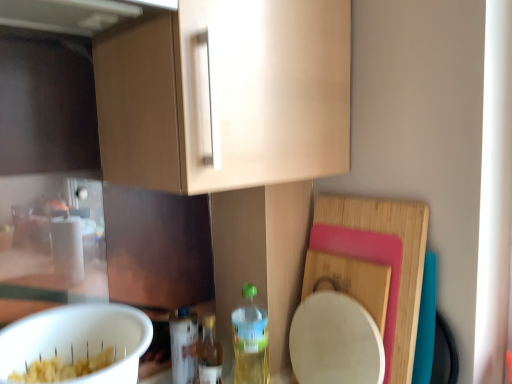
This screenshot has width=512, height=384. What do you see at coordinates (184, 345) in the screenshot? I see `translucent plastic bottle at lower center, arranged as the 1th bottle when viewed from the left` at bounding box center [184, 345].

What do you see at coordinates (250, 338) in the screenshot?
I see `translucent plastic bottle at lower center, the third bottle when ordered from left to right` at bounding box center [250, 338].

The image size is (512, 384). Describe the element at coordinates (79, 340) in the screenshot. I see `white matte mixing bowl at lower left` at that location.

Identify the location of translucent plastic bottle at lower center, arranged as the 1th bottle when viewed from the left. This screenshot has height=384, width=512. (184, 345).

Does white matte mixing bowl at lower left have a lesser height compared to translucent plastic bottle at lower center, which is the 1th bottle from right to left?

Correct, white matte mixing bowl at lower left is not as tall as translucent plastic bottle at lower center, which is the 1th bottle from right to left.

Considering the relative sizes of white matte mixing bowl at lower left and translucent plastic bottle at lower center, the third bottle when ordered from left to right, in the image provided, is white matte mixing bowl at lower left bigger than translucent plastic bottle at lower center, the third bottle when ordered from left to right,?

Yes.

Can we say white matte mixing bowl at lower left lies outside translucent plastic bottle at lower center, the third bottle when ordered from left to right?

Yes, white matte mixing bowl at lower left is not within translucent plastic bottle at lower center, the third bottle when ordered from left to right.

Which is more distant, (263, 335) or (214, 372)?

The point (214, 372) is farther from the camera.

From a real-world perspective, does translucent plastic bottle at lower center, which is the 1th bottle from right to left, stand above translucent plastic bottle at lower center, marked as the second bottle in a left-to-right arrangement?

Yes, from a real-world perspective, translucent plastic bottle at lower center, which is the 1th bottle from right to left, is over translucent plastic bottle at lower center, marked as the second bottle in a left-to-right arrangement

From the image's perspective, which one is positioned lower, translucent plastic bottle at lower center, which is the 1th bottle from right to left, or translucent plastic bottle at lower center, marked as the second bottle in a left-to-right arrangement?

translucent plastic bottle at lower center, marked as the second bottle in a left-to-right arrangement, from the image's perspective.

Considering the relative positions of translucent plastic bottle at lower center, which is the 1th bottle from right to left, and translucent plastic bottle at lower center, marked as the second bottle in a left-to-right arrangement, in the image provided, is translucent plastic bottle at lower center, which is the 1th bottle from right to left, to the right of translucent plastic bottle at lower center, marked as the second bottle in a left-to-right arrangement, from the viewer's perspective?

Yes.

Can you confirm if translucent plastic bottle at lower center, the third bottle when ordered from left to right, is positioned to the right of translucent plastic bottle at lower center, arranged as the 1th bottle when viewed from the left?

Yes, translucent plastic bottle at lower center, the third bottle when ordered from left to right, is to the right of translucent plastic bottle at lower center, arranged as the 1th bottle when viewed from the left.

Is translucent plastic bottle at lower center, the third bottle when ordered from left to right, looking in the opposite direction of translucent plastic bottle at lower center, the third bottle in the right-to-left sequence?

No, translucent plastic bottle at lower center, the third bottle when ordered from left to right, is not facing the opposite direction of translucent plastic bottle at lower center, the third bottle in the right-to-left sequence.

Based on the photo, does translucent plastic bottle at lower center, the third bottle when ordered from left to right, have a lesser height compared to translucent plastic bottle at lower center, arranged as the 1th bottle when viewed from the left?

Incorrect, the height of translucent plastic bottle at lower center, the third bottle when ordered from left to right, does not fall short of that of translucent plastic bottle at lower center, arranged as the 1th bottle when viewed from the left.

Is translucent plastic bottle at lower center, the 2th bottle viewed from the right, to the left or to the right of translucent plastic bottle at lower center, the third bottle in the right-to-left sequence, in the image?

In the image, translucent plastic bottle at lower center, the 2th bottle viewed from the right, appears on the right side of translucent plastic bottle at lower center, the third bottle in the right-to-left sequence.

Is translucent plastic bottle at lower center, marked as the second bottle in a left-to-right arrangement, facing away from translucent plastic bottle at lower center, the third bottle in the right-to-left sequence?

Yes, translucent plastic bottle at lower center, marked as the second bottle in a left-to-right arrangement, is positioned with its back facing translucent plastic bottle at lower center, the third bottle in the right-to-left sequence.

Considering the relative sizes of translucent plastic bottle at lower center, the 2th bottle viewed from the right, and translucent plastic bottle at lower center, the third bottle in the right-to-left sequence, in the image provided, is translucent plastic bottle at lower center, the 2th bottle viewed from the right, bigger than translucent plastic bottle at lower center, the third bottle in the right-to-left sequence,?

Incorrect, translucent plastic bottle at lower center, the 2th bottle viewed from the right, is not larger than translucent plastic bottle at lower center, the third bottle in the right-to-left sequence.

From the image's perspective, relative to translucent plastic bottle at lower center, the third bottle in the right-to-left sequence, is translucent plastic bottle at lower center, the 2th bottle viewed from the right, above or below?

translucent plastic bottle at lower center, the 2th bottle viewed from the right, is situated lower than translucent plastic bottle at lower center, the third bottle in the right-to-left sequence, in the image.

Identify the location of the 1st bottle behind the translucent plastic bottle at lower center, which is the 1th bottle from right to left, counting from the anchor's position. The width and height of the screenshot is (512, 384). (209, 353).

From a real-world perspective, is translucent plastic bottle at lower center, the 2th bottle viewed from the right, physically located above or below translucent plastic bottle at lower center, the third bottle when ordered from left to right?

Clearly, from a real-world perspective, translucent plastic bottle at lower center, the 2th bottle viewed from the right, is below translucent plastic bottle at lower center, the third bottle when ordered from left to right.

Is the depth of translucent plastic bottle at lower center, marked as the second bottle in a left-to-right arrangement, less than that of translucent plastic bottle at lower center, the third bottle when ordered from left to right?

No, translucent plastic bottle at lower center, marked as the second bottle in a left-to-right arrangement, is behind translucent plastic bottle at lower center, the third bottle when ordered from left to right.

Which is more to the right, white matte mixing bowl at lower left or translucent plastic bottle at lower center, the 2th bottle viewed from the right?

translucent plastic bottle at lower center, the 2th bottle viewed from the right.

Is white matte mixing bowl at lower left bigger than translucent plastic bottle at lower center, marked as the second bottle in a left-to-right arrangement?

Indeed, white matte mixing bowl at lower left has a larger size compared to translucent plastic bottle at lower center, marked as the second bottle in a left-to-right arrangement.

Is white matte mixing bowl at lower left placed right next to translucent plastic bottle at lower center, marked as the second bottle in a left-to-right arrangement?

No, white matte mixing bowl at lower left is not touching translucent plastic bottle at lower center, marked as the second bottle in a left-to-right arrangement.

From the picture: Which of these two, white matte mixing bowl at lower left or translucent plastic bottle at lower center, the 2th bottle viewed from the right, is thinner?

With smaller width is translucent plastic bottle at lower center, the 2th bottle viewed from the right.

Does translucent plastic bottle at lower center, arranged as the 1th bottle when viewed from the left, have a greater height compared to white matte mixing bowl at lower left?

Yes.

From the image's perspective, which is below, translucent plastic bottle at lower center, the third bottle in the right-to-left sequence, or white matte mixing bowl at lower left?

translucent plastic bottle at lower center, the third bottle in the right-to-left sequence, is shown below in the image.

Who is bigger, translucent plastic bottle at lower center, arranged as the 1th bottle when viewed from the left, or white matte mixing bowl at lower left?

white matte mixing bowl at lower left is bigger.

Locate an element on the screen. mixing bowl located above the translucent plastic bottle at lower center, the third bottle in the right-to-left sequence (from a real-world perspective) is located at coordinates pyautogui.click(x=79, y=340).

From the image's perspective, starting from the white matte mixing bowl at lower left, which bottle is the 1st one below? Please provide its 2D coordinates.

[(250, 338)]

Find the location of `the 1st bottle to the left of the translucent plastic bottle at lower center, the third bottle when ordered from left to right, starting your count from the anchor`. the 1st bottle to the left of the translucent plastic bottle at lower center, the third bottle when ordered from left to right, starting your count from the anchor is located at coordinates (209, 353).

In the scene shown: Based on their spatial positions, is white matte mixing bowl at lower left or translucent plastic bottle at lower center, the 2th bottle viewed from the right, closer to translucent plastic bottle at lower center, arranged as the 1th bottle when viewed from the left?

translucent plastic bottle at lower center, the 2th bottle viewed from the right, is positioned closer to the anchor translucent plastic bottle at lower center, arranged as the 1th bottle when viewed from the left.

Considering their positions, is translucent plastic bottle at lower center, the third bottle in the right-to-left sequence, positioned closer to translucent plastic bottle at lower center, the 2th bottle viewed from the right, than white matte mixing bowl at lower left?

translucent plastic bottle at lower center, the third bottle in the right-to-left sequence, lies closer to translucent plastic bottle at lower center, the 2th bottle viewed from the right, than the other object.

Which object lies nearer to the anchor point white matte mixing bowl at lower left, translucent plastic bottle at lower center, the third bottle when ordered from left to right, or translucent plastic bottle at lower center, marked as the second bottle in a left-to-right arrangement?

The object closer to white matte mixing bowl at lower left is translucent plastic bottle at lower center, marked as the second bottle in a left-to-right arrangement.

From the image, which object appears to be nearer to white matte mixing bowl at lower left, translucent plastic bottle at lower center, arranged as the 1th bottle when viewed from the left, or translucent plastic bottle at lower center, marked as the second bottle in a left-to-right arrangement?

translucent plastic bottle at lower center, arranged as the 1th bottle when viewed from the left, is closer to white matte mixing bowl at lower left.

Considering their positions, is white matte mixing bowl at lower left positioned closer to translucent plastic bottle at lower center, which is the 1th bottle from right to left, than translucent plastic bottle at lower center, arranged as the 1th bottle when viewed from the left?

The object closer to translucent plastic bottle at lower center, which is the 1th bottle from right to left, is translucent plastic bottle at lower center, arranged as the 1th bottle when viewed from the left.

Based on their spatial positions, is translucent plastic bottle at lower center, the 2th bottle viewed from the right, or translucent plastic bottle at lower center, the third bottle when ordered from left to right, further from white matte mixing bowl at lower left?

Among the two, translucent plastic bottle at lower center, the third bottle when ordered from left to right, is located further to white matte mixing bowl at lower left.

Based on their spatial positions, is translucent plastic bottle at lower center, which is the 1th bottle from right to left, or translucent plastic bottle at lower center, the third bottle in the right-to-left sequence, closer to translucent plastic bottle at lower center, marked as the second bottle in a left-to-right arrangement?

Among the two, translucent plastic bottle at lower center, the third bottle in the right-to-left sequence, is located nearer to translucent plastic bottle at lower center, marked as the second bottle in a left-to-right arrangement.

From the image, which object appears to be farther from translucent plastic bottle at lower center, which is the 1th bottle from right to left, translucent plastic bottle at lower center, marked as the second bottle in a left-to-right arrangement, or white matte mixing bowl at lower left?

white matte mixing bowl at lower left is further to translucent plastic bottle at lower center, which is the 1th bottle from right to left.

You are a GUI agent. You are given a task and a screenshot of the screen. Output one action in this format:
    pyautogui.click(x=<x>, y=<y>)
    Task: Click on the bottle between white matte mixing bowl at lower left and translucent plastic bottle at lower center, the 2th bottle viewed from the right, along the z-axis
    
    Given the screenshot: What is the action you would take?
    pyautogui.click(x=250, y=338)

Where is `bottle between translucent plastic bottle at lower center, the third bottle in the right-to-left sequence, and translucent plastic bottle at lower center, the third bottle when ordered from left to right, in the horizontal direction`? The width and height of the screenshot is (512, 384). bottle between translucent plastic bottle at lower center, the third bottle in the right-to-left sequence, and translucent plastic bottle at lower center, the third bottle when ordered from left to right, in the horizontal direction is located at coordinates (209, 353).